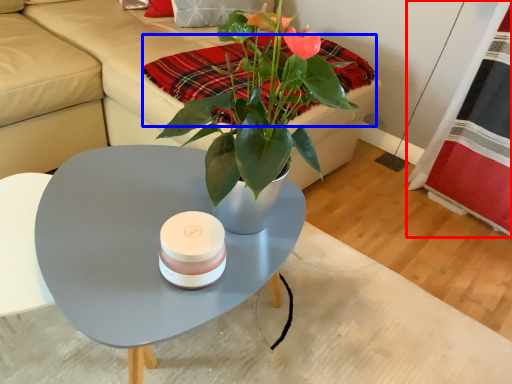
Question: Which of the following is the farthest to the observer, plaid (highlighted by a red box) or blanket (highlighted by a blue box)?

Choices:
 (A) plaid
 (B) blanket

Answer: (A)